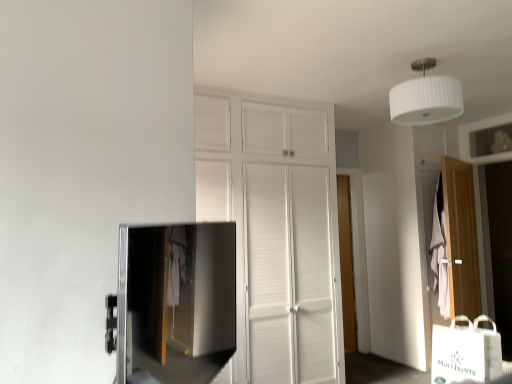
Question: Can you confirm if white ribbed shade at upper center is positioned to the left of white paper bag at lower right?

Choices:
 (A) no
 (B) yes

Answer: (A)

Question: Is white ribbed shade at upper center facing away from white paper bag at lower right?

Choices:
 (A) yes
 (B) no

Answer: (B)

Question: Is white ribbed shade at upper center outside of white paper bag at lower right?

Choices:
 (A) yes
 (B) no

Answer: (A)

Question: Considering the relative sizes of white ribbed shade at upper center and white paper bag at lower right in the image provided, is white ribbed shade at upper center bigger than white paper bag at lower right?

Choices:
 (A) yes
 (B) no

Answer: (A)

Question: Are white ribbed shade at upper center and white paper bag at lower right located far from each other?

Choices:
 (A) no
 (B) yes

Answer: (B)

Question: Do you think satin black tv at lower left is within wooden door at right, which appears as the 1th door when viewed from the front, or outside of it?

Choices:
 (A) outside
 (B) inside

Answer: (A)

Question: From their relative heights in the image, would you say satin black tv at lower left is taller or shorter than wooden door at right, the 2th door from the left?

Choices:
 (A) short
 (B) tall

Answer: (A)

Question: Is satin black tv at lower left in front of or behind wooden door at right, the 2th door when ordered from back to front, in the image?

Choices:
 (A) front
 (B) behind

Answer: (A)

Question: Based on their positions, is satin black tv at lower left located to the left or right of wooden door at right, the 2th door when ordered from back to front?

Choices:
 (A) left
 (B) right

Answer: (A)

Question: Looking at their shapes, would you say white paper bag at lower right is wider or thinner than white ribbed shade at upper center?

Choices:
 (A) wide
 (B) thin

Answer: (B)

Question: From the image's perspective, is white paper bag at lower right positioned above or below white ribbed shade at upper center?

Choices:
 (A) above
 (B) below

Answer: (B)

Question: Is white paper bag at lower right situated inside white ribbed shade at upper center or outside?

Choices:
 (A) inside
 (B) outside

Answer: (B)

Question: From a real-world perspective, is white paper bag at lower right positioned above or below white ribbed shade at upper center?

Choices:
 (A) below
 (B) above

Answer: (A)

Question: Would you say white ribbed shade at upper center is inside or outside white paper bag at lower right?

Choices:
 (A) outside
 (B) inside

Answer: (A)

Question: Is point (421, 107) positioned closer to the camera than point (483, 372)?

Choices:
 (A) farther
 (B) closer

Answer: (A)